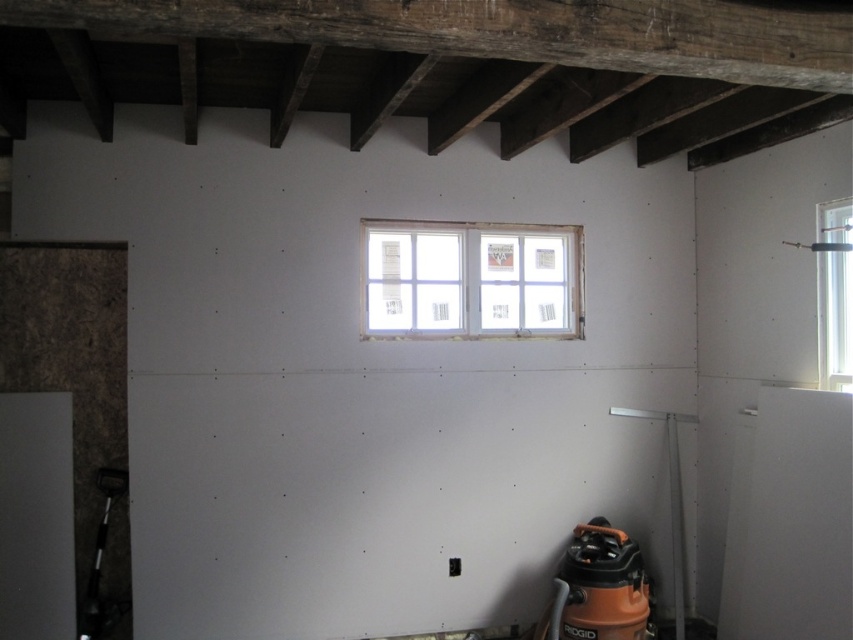
Between point (405, 276) and point (828, 326), which one is positioned behind?

The point (405, 276) is more distant.

Does point (451, 228) come behind point (846, 200)?

That is True.

I want to click on clear glass window at upper center, so click(471, 278).

Can you confirm if clear glass window at upper center is positioned to the right of orange plastic vacuum cleaner at lower right?

Incorrect, clear glass window at upper center is not on the right side of orange plastic vacuum cleaner at lower right.

Can you confirm if clear glass window at upper center is thinner than orange plastic vacuum cleaner at lower right?

Incorrect, clear glass window at upper center's width is not less than orange plastic vacuum cleaner at lower right's.

Who is more distant from viewer, (431, 330) or (598, 602)?

Point (431, 330)

Find the location of a particular element. clear glass window at upper center is located at coordinates (471, 278).

Is orange plastic vacuum cleaner at lower right shorter than clear glass window at upper right?

Indeed, orange plastic vacuum cleaner at lower right has a lesser height compared to clear glass window at upper right.

Consider the image. Between orange plastic vacuum cleaner at lower right and clear glass window at upper right, which one is positioned higher?

clear glass window at upper right is above.

Is point (572, 557) positioned after point (827, 384)?

Yes.

In order to click on orange plastic vacuum cleaner at lower right in this screenshot , I will do `click(599, 588)`.